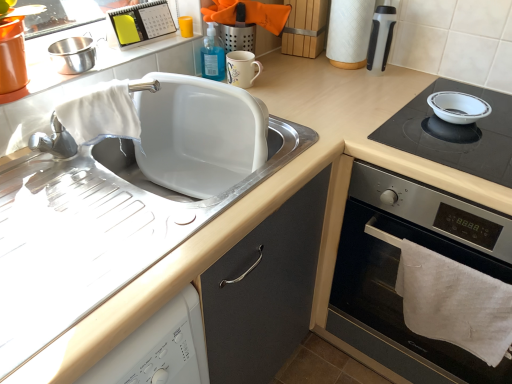
Image resolution: width=512 pixels, height=384 pixels. In order to click on vacant space to the right of matte ceramic mug at upper center, acting as the third appliance starting from the left in this screenshot , I will do `click(298, 90)`.